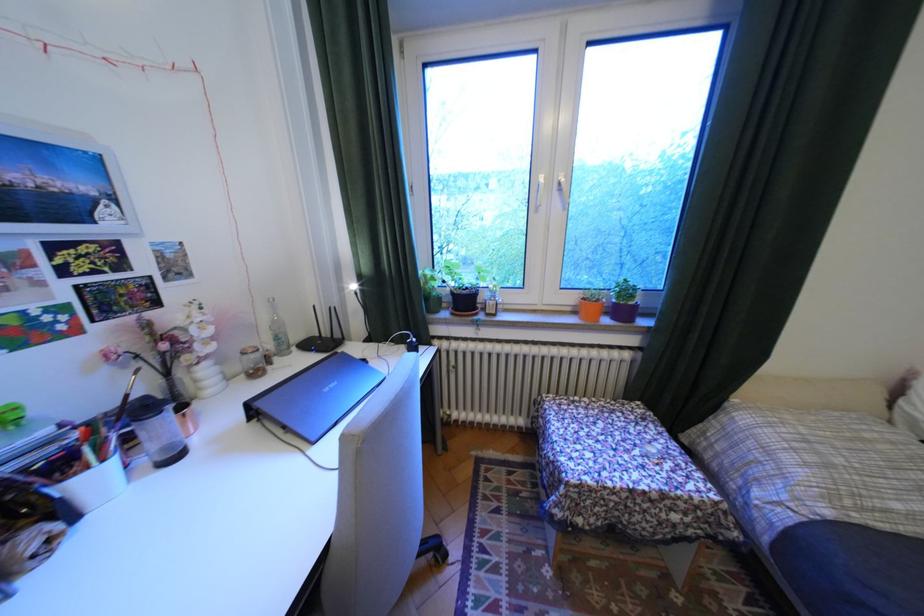
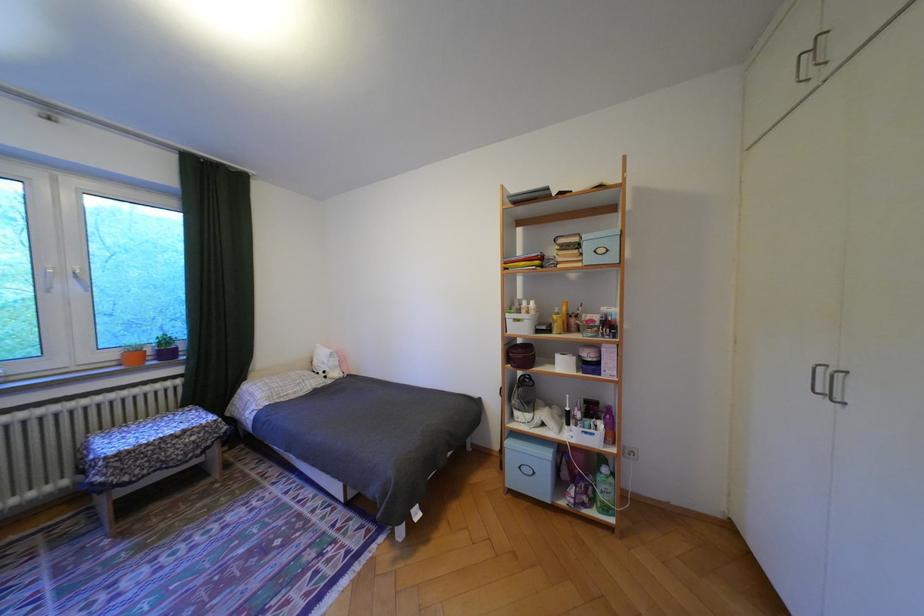
Locate, in the second image, the point that corresponds to [634,312] in the first image.

(178, 354)